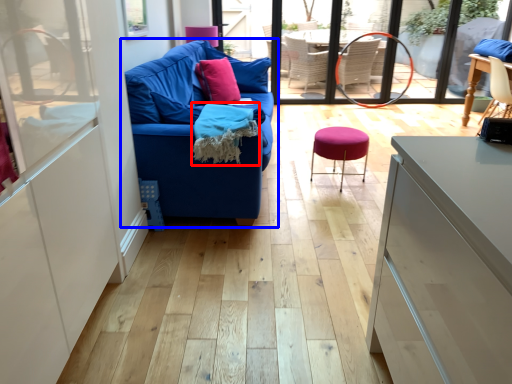
Question: Which point is closer to the camera, material (highlighted by a red box) or studio couch (highlighted by a blue box)?

Choices:
 (A) material
 (B) studio couch

Answer: (B)